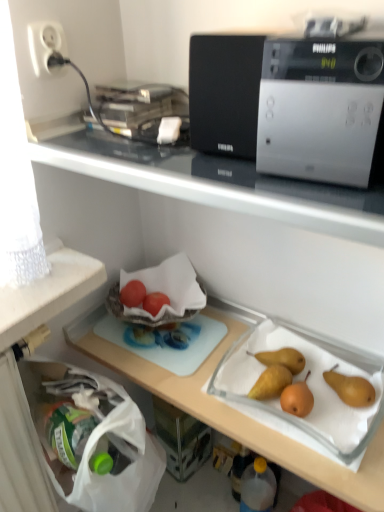
I want to click on space that is in front of matte red tomato at center, which is counted as the 2th fruit, starting from the left, so click(164, 344).